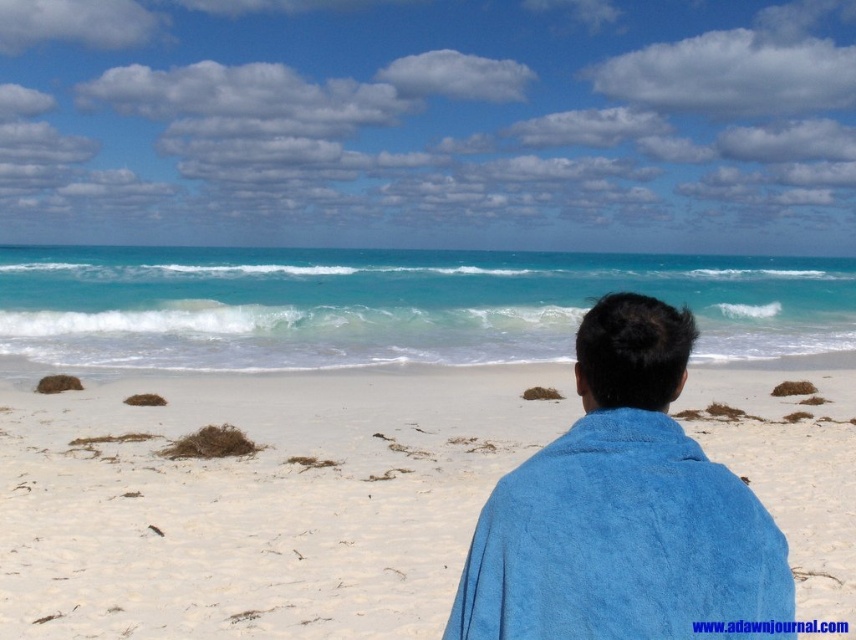
Is white sandy beach at center positioned at the back of blue towel at center?

Yes, white sandy beach at center is further from the viewer.

Which of these two, white sandy beach at center or blue towel at center, stands shorter?

blue towel at center

Between point (467, 381) and point (696, 566), which one is positioned behind?

The point (467, 381) is more distant.

This screenshot has width=856, height=640. I want to click on white sandy beach at center, so click(x=259, y=500).